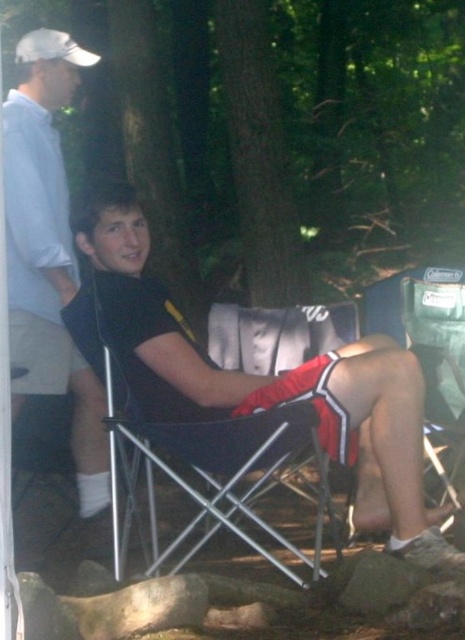
You are setting up a campsite and need to ensure there is enough space between the black fabric shorts at center and the black fabric chair at center. According to the scene, which object is wider?

The black fabric shorts at center is wider than the black fabric chair at center.

From the picture: You are a photographer setting up a shot at the campsite. You want to ensure the black matte shirt at upper left and the black fabric chair at center are both in focus. Given that your camera has a depth of field that can cover objects within a 30 inch range, will both items remain in focus?

The black matte shirt at upper left is 28.27 inches away from the black fabric chair at center. Since the distance between them is within the 30 inch range of the camera, both items will remain in focus.